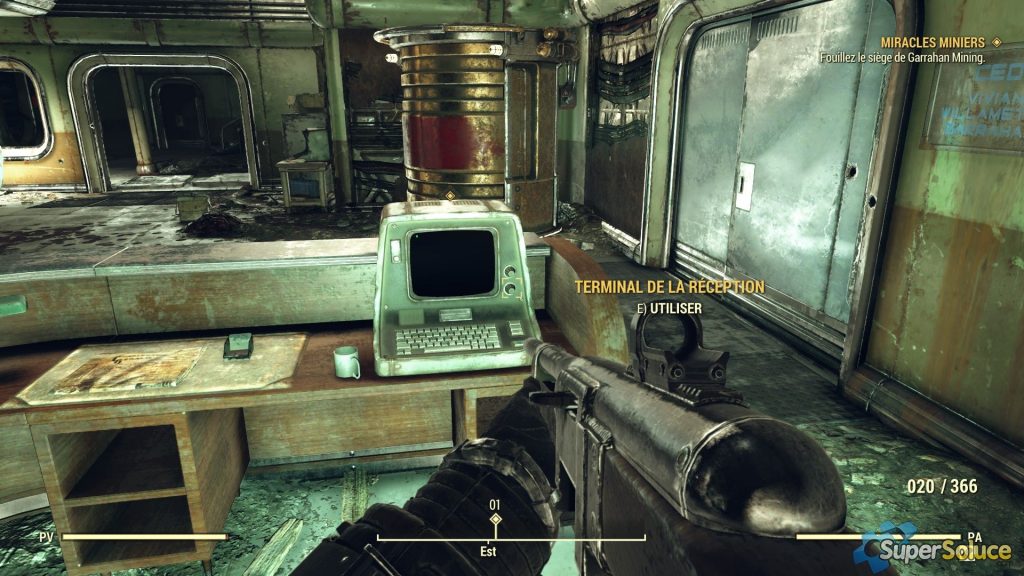
Where is `green floor`? The width and height of the screenshot is (1024, 576). green floor is located at coordinates (855, 438).